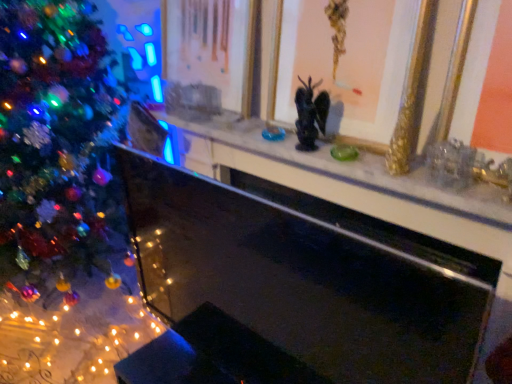
Question: Looking at the image, does gold/golden picture frame at upper center, the second picture frame viewed from the left, seem bigger or smaller compared to black glass fireplace at center?

Choices:
 (A) big
 (B) small

Answer: (B)

Question: From a real-world perspective, relative to black glass fireplace at center, is gold/golden picture frame at upper center, the second picture frame viewed from the left, vertically above or below?

Choices:
 (A) below
 (B) above

Answer: (B)

Question: Which is farther from the black glass fireplace at center?

Choices:
 (A) gold/golden picture frame at upper center, the 1th picture frame in the right-to-left sequence
 (B) gold/gilded picture frame at upper center, the second picture frame when ordered from right to left
 (C) marble mantel at center
 (D) shiny multicolored ornaments at left

Answer: (D)

Question: Which object is positioned farthest from the gold/golden picture frame at upper center, the 1th picture frame in the right-to-left sequence?

Choices:
 (A) shiny multicolored ornaments at left
 (B) black glass fireplace at center
 (C) gold/gilded picture frame at upper center, the first picture frame when ordered from left to right
 (D) marble mantel at center

Answer: (A)